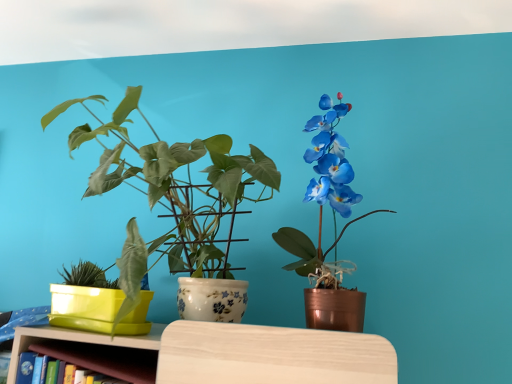
Describe the element at coordinates (108, 296) in the screenshot. I see `matte yellow plastic pot at left, positioned as the 3th houseplant in right-to-left order` at that location.

This screenshot has height=384, width=512. I want to click on matte copper pot at right, the third houseplant when ordered from left to right, so click(x=321, y=227).

The height and width of the screenshot is (384, 512). What do you see at coordinates (172, 194) in the screenshot?
I see `matte white pot at center, which is the second houseplant from left to right` at bounding box center [172, 194].

Find the location of a particular element. Image resolution: width=512 pixels, height=384 pixels. matte yellow plastic pot at left, the first houseplant from the left is located at coordinates (108, 296).

Which is correct: matte yellow plastic pot at left, positioned as the 3th houseplant in right-to-left order, is inside matte white pot at center, which is the second houseplant from left to right, or outside of it?

matte yellow plastic pot at left, positioned as the 3th houseplant in right-to-left order, exists entirely within matte white pot at center, which is the second houseplant from left to right.

From a real-world perspective, is matte yellow plastic pot at left, the first houseplant from the left, physically above matte white pot at center, which appears as the second houseplant when viewed from the right?

No, from a real-world perspective, matte yellow plastic pot at left, the first houseplant from the left, is not over matte white pot at center, which appears as the second houseplant when viewed from the right

Considering the sizes of objects matte yellow plastic pot at left, the first houseplant from the left, and matte white pot at center, which is the second houseplant from left to right, in the image provided, who is thinner, matte yellow plastic pot at left, the first houseplant from the left, or matte white pot at center, which is the second houseplant from left to right,?

matte yellow plastic pot at left, the first houseplant from the left.

In terms of size, does matte yellow plastic pot at left, positioned as the 3th houseplant in right-to-left order, appear bigger or smaller than matte white pot at center, which appears as the second houseplant when viewed from the right?

matte yellow plastic pot at left, positioned as the 3th houseplant in right-to-left order, is smaller than matte white pot at center, which appears as the second houseplant when viewed from the right.

Would you say wooden shelf at lower left is to the left or to the right of matte yellow plastic pot at left, the first houseplant from the left, in the picture?

Clearly, wooden shelf at lower left is on the right of matte yellow plastic pot at left, the first houseplant from the left, in the image.

Who is smaller, wooden shelf at lower left or matte yellow plastic pot at left, positioned as the 3th houseplant in right-to-left order?

wooden shelf at lower left.

Is wooden shelf at lower left oriented away from matte yellow plastic pot at left, positioned as the 3th houseplant in right-to-left order?

No, wooden shelf at lower left is not facing the opposite direction of matte yellow plastic pot at left, positioned as the 3th houseplant in right-to-left order.

How many degrees apart are the facing directions of wooden shelf at lower left and matte yellow plastic pot at left, the first houseplant from the left?

The facing directions of wooden shelf at lower left and matte yellow plastic pot at left, the first houseplant from the left, are 16.9 degrees apart.

Can matte white pot at center, which appears as the second houseplant when viewed from the right, be found inside matte copper pot at right, the first houseplant in the right-to-left sequence?

Actually, matte white pot at center, which appears as the second houseplant when viewed from the right, is outside matte copper pot at right, the first houseplant in the right-to-left sequence.

Could you tell me if matte copper pot at right, the third houseplant when ordered from left to right, is facing matte white pot at center, which is the second houseplant from left to right?

No.

Does point (289, 246) lie behind point (134, 147)?

No, (289, 246) is closer to viewer.

From the image's perspective, which is below, matte copper pot at right, the third houseplant when ordered from left to right, or matte white pot at center, which is the second houseplant from left to right?

matte white pot at center, which is the second houseplant from left to right, appears lower in the image.

Is matte yellow plastic pot at left, the first houseplant from the left, completely or partially outside of matte copper pot at right, the first houseplant in the right-to-left sequence?

Yes, matte yellow plastic pot at left, the first houseplant from the left, is outside of matte copper pot at right, the first houseplant in the right-to-left sequence.

Is point (143, 293) closer or farther from the camera than point (332, 144)?

Point (143, 293) is positioned closer to the camera compared to point (332, 144).

Identify the location of houseplant behind the matte copper pot at right, the third houseplant when ordered from left to right. This screenshot has width=512, height=384. (108, 296).

Considering the relative sizes of matte yellow plastic pot at left, the first houseplant from the left, and matte copper pot at right, the first houseplant in the right-to-left sequence, in the image provided, is matte yellow plastic pot at left, the first houseplant from the left, shorter than matte copper pot at right, the first houseplant in the right-to-left sequence,?

Indeed, matte yellow plastic pot at left, the first houseplant from the left, has a lesser height compared to matte copper pot at right, the first houseplant in the right-to-left sequence.

Where is `houseplant that is the 1st one when counting rightward from the wooden shelf at lower left`? Image resolution: width=512 pixels, height=384 pixels. houseplant that is the 1st one when counting rightward from the wooden shelf at lower left is located at coordinates (172, 194).

Is matte white pot at center, which appears as the second houseplant when viewed from the right, placed right next to wooden shelf at lower left?

They are not placed beside each other.

Can you confirm if matte white pot at center, which is the second houseplant from left to right, is taller than wooden shelf at lower left?

Correct, matte white pot at center, which is the second houseplant from left to right, is much taller as wooden shelf at lower left.

Based on their sizes in the image, would you say matte white pot at center, which appears as the second houseplant when viewed from the right, is bigger or smaller than wooden shelf at lower left?

matte white pot at center, which appears as the second houseplant when viewed from the right, is bigger than wooden shelf at lower left.

From a real-world perspective, who is located lower, matte yellow plastic pot at left, the first houseplant from the left, or wooden shelf at lower left?

From a 3D spatial view, wooden shelf at lower left is below.

Does point (97, 325) appear closer or farther from the camera than point (91, 341)?

Point (97, 325) is positioned farther from the camera compared to point (91, 341).

Is matte yellow plastic pot at left, positioned as the 3th houseplant in right-to-left order, not near wooden shelf at lower left?

Actually, matte yellow plastic pot at left, positioned as the 3th houseplant in right-to-left order, and wooden shelf at lower left are a little close together.

Considering the positions of objects matte copper pot at right, the first houseplant in the right-to-left sequence, and wooden shelf at lower left in the image provided, who is more to the left, matte copper pot at right, the first houseplant in the right-to-left sequence, or wooden shelf at lower left?

wooden shelf at lower left.

Can you confirm if matte copper pot at right, the first houseplant in the right-to-left sequence, is bigger than wooden shelf at lower left?

Yes, matte copper pot at right, the first houseplant in the right-to-left sequence, is bigger than wooden shelf at lower left.

Is matte copper pot at right, the first houseplant in the right-to-left sequence, spatially inside wooden shelf at lower left, or outside of it?

matte copper pot at right, the first houseplant in the right-to-left sequence, is outside wooden shelf at lower left.

The width and height of the screenshot is (512, 384). I want to click on houseplant that is the 1st object to the right of the matte yellow plastic pot at left, positioned as the 3th houseplant in right-to-left order, starting at the anchor, so click(172, 194).

Where is `shelf in front of the matte yellow plastic pot at left, the first houseplant from the left`? The image size is (512, 384). shelf in front of the matte yellow plastic pot at left, the first houseplant from the left is located at coordinates (92, 351).

From the image, which object appears to be farther from matte copper pot at right, the first houseplant in the right-to-left sequence, wooden shelf at lower left or matte white pot at center, which is the second houseplant from left to right?

wooden shelf at lower left is positioned further to the anchor matte copper pot at right, the first houseplant in the right-to-left sequence.

Looking at the image, which one is located further to matte copper pot at right, the first houseplant in the right-to-left sequence, wooden shelf at lower left or matte yellow plastic pot at left, positioned as the 3th houseplant in right-to-left order?

Among the two, wooden shelf at lower left is located further to matte copper pot at right, the first houseplant in the right-to-left sequence.

When comparing their distances from matte yellow plastic pot at left, positioned as the 3th houseplant in right-to-left order, does matte copper pot at right, the third houseplant when ordered from left to right, or matte white pot at center, which is the second houseplant from left to right, seem closer?

matte white pot at center, which is the second houseplant from left to right, is closer to matte yellow plastic pot at left, positioned as the 3th houseplant in right-to-left order.

Which object lies nearer to the anchor point matte yellow plastic pot at left, positioned as the 3th houseplant in right-to-left order, matte white pot at center, which appears as the second houseplant when viewed from the right, or wooden shelf at lower left?

wooden shelf at lower left is positioned closer to the anchor matte yellow plastic pot at left, positioned as the 3th houseplant in right-to-left order.

Considering their positions, is matte yellow plastic pot at left, the first houseplant from the left, positioned further to wooden shelf at lower left than matte white pot at center, which is the second houseplant from left to right?

matte white pot at center, which is the second houseplant from left to right, lies further to wooden shelf at lower left than the other object.

Looking at the image, which one is located further to matte copper pot at right, the first houseplant in the right-to-left sequence, matte white pot at center, which is the second houseplant from left to right, or matte yellow plastic pot at left, positioned as the 3th houseplant in right-to-left order?

Based on the image, matte yellow plastic pot at left, positioned as the 3th houseplant in right-to-left order, appears to be further to matte copper pot at right, the first houseplant in the right-to-left sequence.

Considering their positions, is wooden shelf at lower left positioned further to matte yellow plastic pot at left, the first houseplant from the left, than matte white pot at center, which appears as the second houseplant when viewed from the right?

matte white pot at center, which appears as the second houseplant when viewed from the right, lies further to matte yellow plastic pot at left, the first houseplant from the left, than the other object.

Considering their positions, is matte copper pot at right, the third houseplant when ordered from left to right, positioned further to matte white pot at center, which appears as the second houseplant when viewed from the right, than wooden shelf at lower left?

wooden shelf at lower left is positioned further to the anchor matte white pot at center, which appears as the second houseplant when viewed from the right.

I want to click on houseplant between matte yellow plastic pot at left, positioned as the 3th houseplant in right-to-left order, and matte copper pot at right, the third houseplant when ordered from left to right, so click(172, 194).

The image size is (512, 384). What are the coordinates of `houseplant located between wooden shelf at lower left and matte copper pot at right, the first houseplant in the right-to-left sequence, in the left-right direction` in the screenshot? It's located at (172, 194).

Locate an element on the screen. houseplant between matte white pot at center, which is the second houseplant from left to right, and wooden shelf at lower left from top to bottom is located at coordinates (108, 296).

You are a GUI agent. You are given a task and a screenshot of the screen. Output one action in this format:
    pyautogui.click(x=<x>, y=<y>)
    Task: Click on the shelf situated between matte yellow plastic pot at left, positioned as the 3th houseplant in right-to-left order, and matte copper pot at right, the first houseplant in the right-to-left sequence, from left to right
    
    Given the screenshot: What is the action you would take?
    pyautogui.click(x=92, y=351)